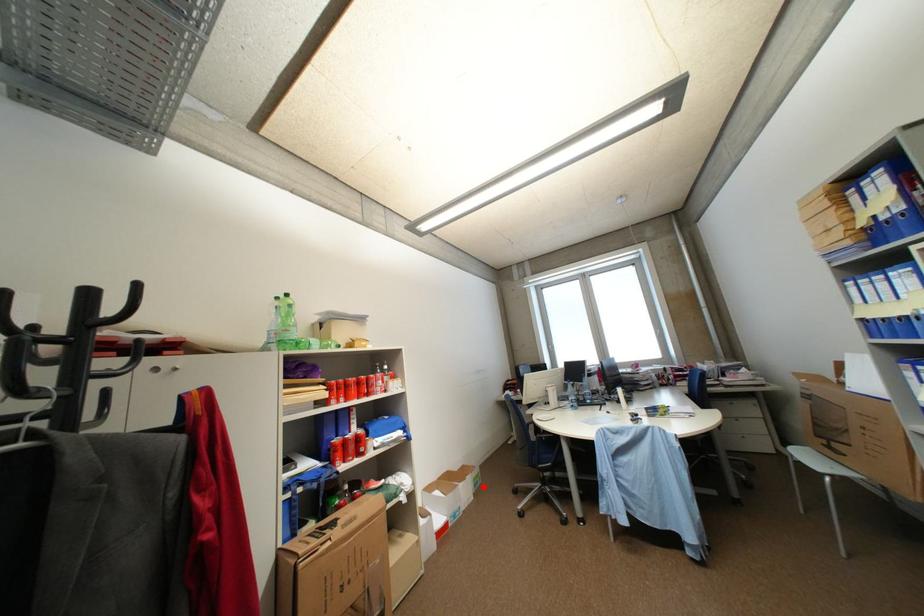
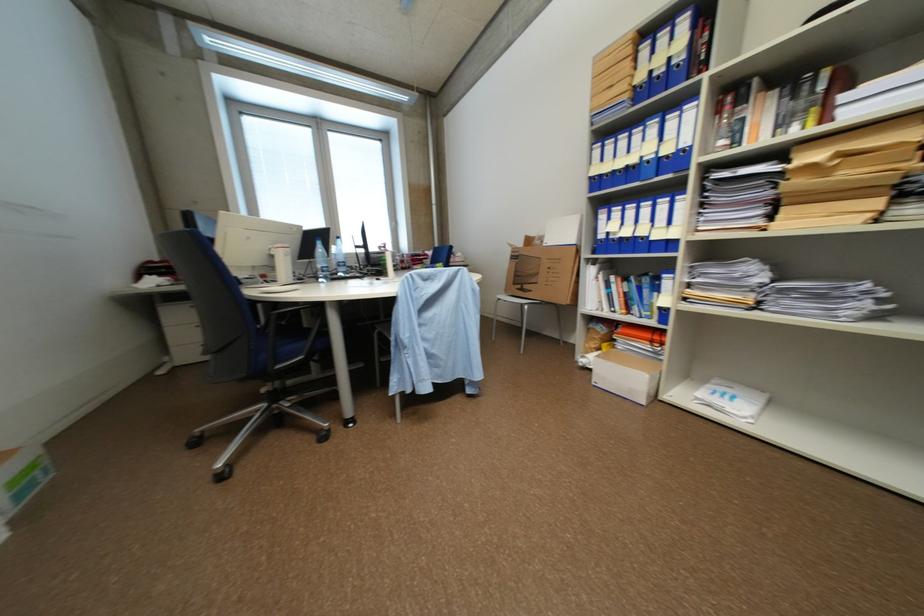
In the second image, find the point that corresponds to the highlighted location in the first image.

(28, 496)